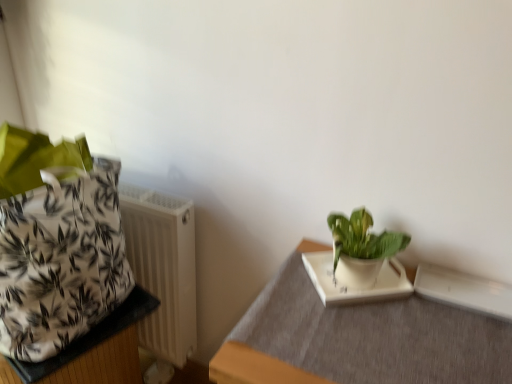
Locate an element on the screen. The height and width of the screenshot is (384, 512). vacant area that is in front of green glossy plant at upper right is located at coordinates (381, 332).